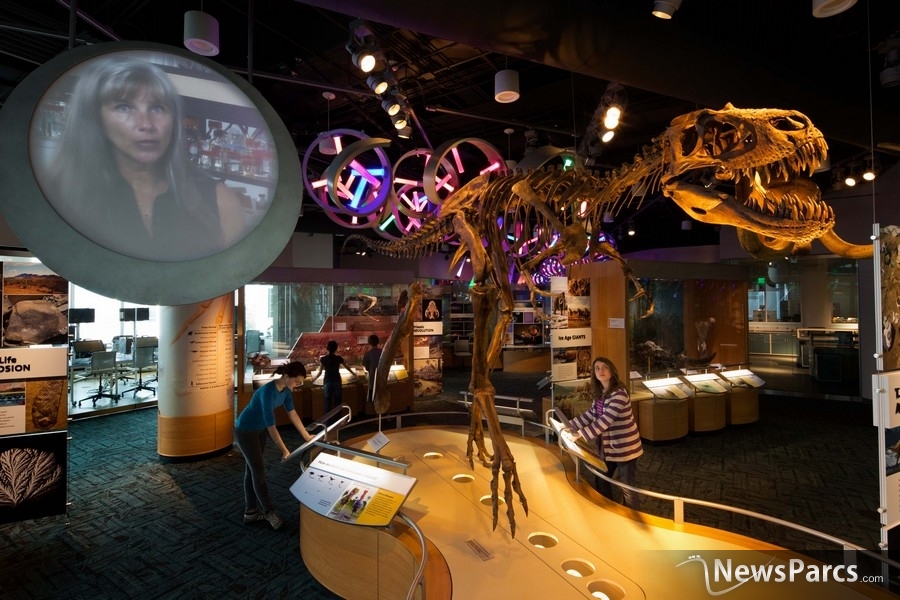
What are the coordinates of `blue carpet on floor` in the screenshot? It's located at (130, 513), (208, 532), (137, 436).